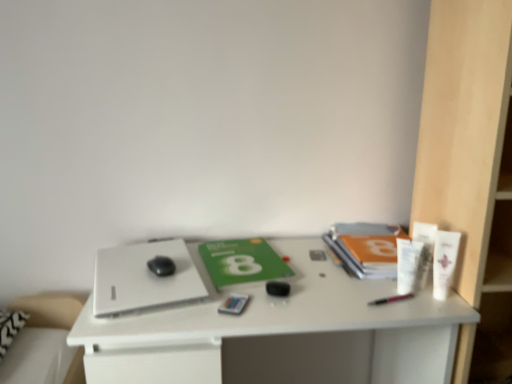
Find the location of `free space between matte plastic card at center, which appears as the first stationery when viewed from the left, and black plastic pen at center, arranged as the 1th stationery when viewed from the right`. free space between matte plastic card at center, which appears as the first stationery when viewed from the left, and black plastic pen at center, arranged as the 1th stationery when viewed from the right is located at coordinates (309, 303).